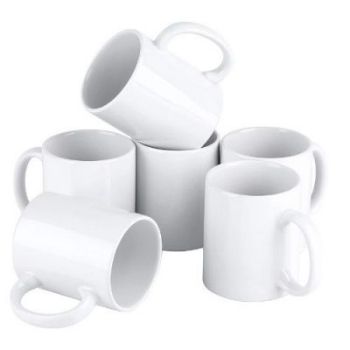
This screenshot has height=350, width=350. I want to click on mugs, so click(84, 245), click(97, 183), click(165, 184), click(166, 110), click(306, 163), click(255, 238).